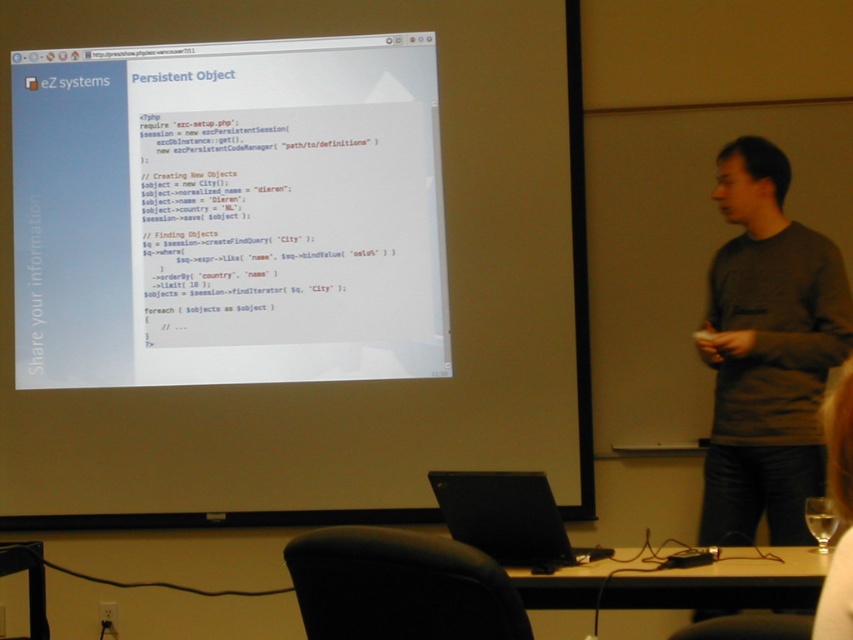
Which of these two, black matte laptop at center or white fabric shirt at lower right, stands shorter?

black matte laptop at center

Does black matte laptop at center lie behind white fabric shirt at lower right?

Yes, black matte laptop at center is further from the viewer.

Who is more forward, (433, 477) or (849, 561)?

Point (849, 561) is more forward.

At what (x,y) coordinates should I click in order to perform the action: click on black matte laptop at center. Please return your answer as a coordinate pair (x, y). This screenshot has height=640, width=853. Looking at the image, I should click on click(x=508, y=518).

Can you confirm if white paper at upper center is positioned below black matte laptop at center?

No, white paper at upper center is not below black matte laptop at center.

Does point (67, 244) lie in front of point (515, 564)?

No, it is not.

The image size is (853, 640). In order to click on white paper at upper center in this screenshot , I will do `click(228, 212)`.

Between white paper at upper center and white fabric shirt at lower right, which one appears on the right side from the viewer's perspective?

Positioned to the right is white fabric shirt at lower right.

Which is in front, point (293, 64) or point (843, 424)?

Positioned in front is point (843, 424).

Find the location of `white paper at upper center`. white paper at upper center is located at coordinates (228, 212).